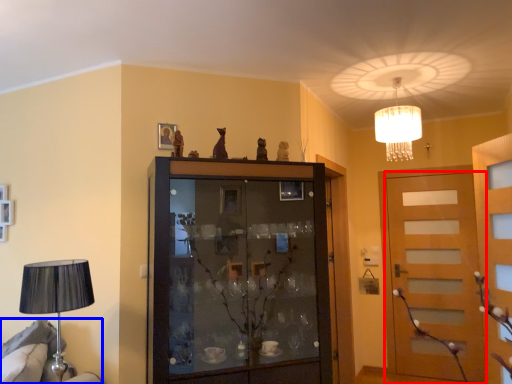
Question: Which of the following is the farthest to the observer, door (highlighted by a red box) or furniture (highlighted by a blue box)?

Choices:
 (A) door
 (B) furniture

Answer: (A)